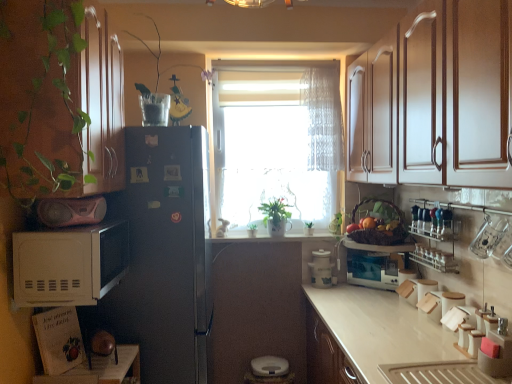
The image size is (512, 384). I want to click on vacant space behind white plastic soap dispenser at lower right, placed as the fourth appliance when sorted from back to front, so click(x=450, y=353).